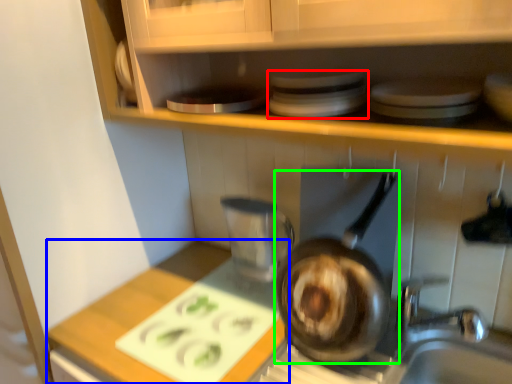
Question: Estimate the real-world distances between objects in this image. Which object is closer to appliance (highlighted by a red box), counter top (highlighted by a blue box) or frying pan (highlighted by a green box)?

Choices:
 (A) counter top
 (B) frying pan

Answer: (B)